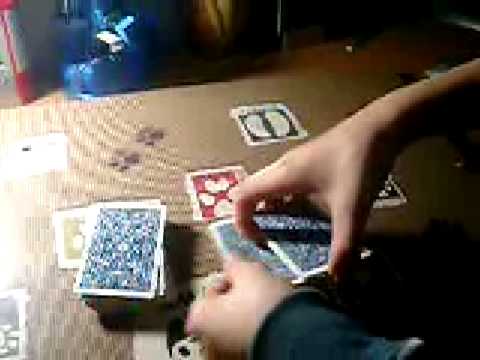
This screenshot has width=480, height=360. In order to click on wood table in this screenshot , I will do `click(118, 122)`, `click(176, 126)`, `click(163, 146)`, `click(51, 196)`, `click(40, 274)`, `click(58, 304)`.